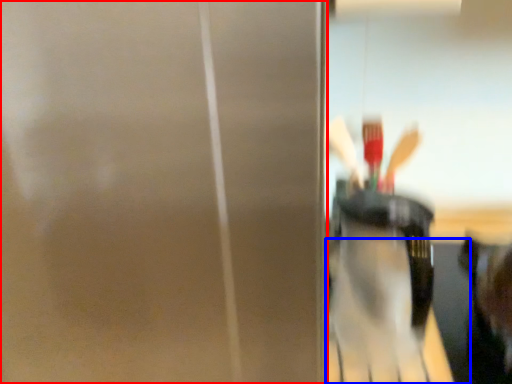
Question: Which object appears closest to the camera in this image, screen door (highlighted by a red box) or table (highlighted by a blue box)?

Choices:
 (A) screen door
 (B) table

Answer: (A)